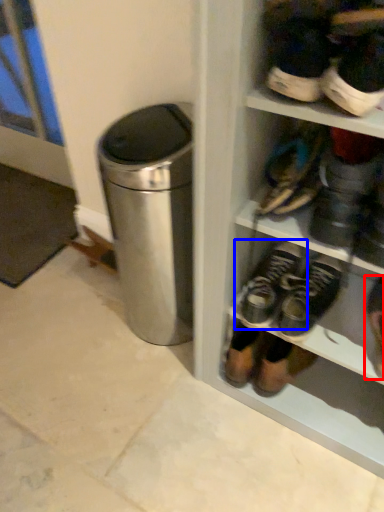
Question: Which of the following is the closest to the observer, footwear (highlighted by a red box) or footwear (highlighted by a blue box)?

Choices:
 (A) footwear
 (B) footwear

Answer: (A)